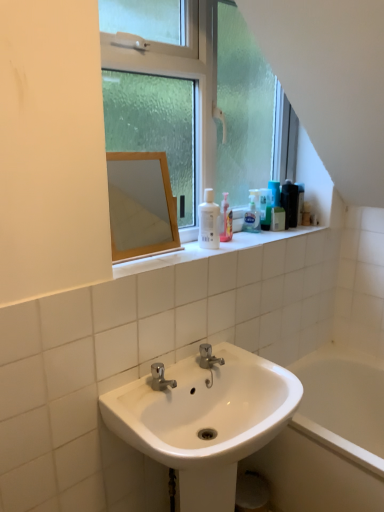
Question: Relative to white glossy bathtub at lower right, is black glossy bottle at upper right, which is counted as the 4th mouthwash, starting from the left, in front or behind?

Choices:
 (A) behind
 (B) front

Answer: (A)

Question: Considering the positions of black glossy bottle at upper right, which is counted as the 2th mouthwash, starting from the right, and white glossy bathtub at lower right in the image, is black glossy bottle at upper right, which is counted as the 2th mouthwash, starting from the right, wider or thinner than white glossy bathtub at lower right?

Choices:
 (A) thin
 (B) wide

Answer: (A)

Question: Which of these objects is positioned closest to the white glossy sink at lower center?

Choices:
 (A) clear glass window at upper center
 (B) white glossy bottle at upper center, the 1th mouthwash from the front
 (C) black glossy bottle at upper right, which is counted as the 2th mouthwash, starting from the right
 (D) green matte bottle at upper right, the 3th mouthwash when ordered from back to front
 (E) translucent plastic soap dispenser at upper center

Answer: (B)

Question: Estimate the real-world distances between objects in this image. Which object is farther from the white glossy bottle at upper center, the 1th mouthwash when ordered from left to right?

Choices:
 (A) white glossy bathtub at lower right
 (B) wooden frame mirror at upper center
 (C) green matte bottle at upper right, positioned as the fourth mouthwash in right-to-left order
 (D) clear glass window at upper center
 (E) black plastic mouthwash at upper right, which is the fifth mouthwash in front-to-back order

Answer: (B)